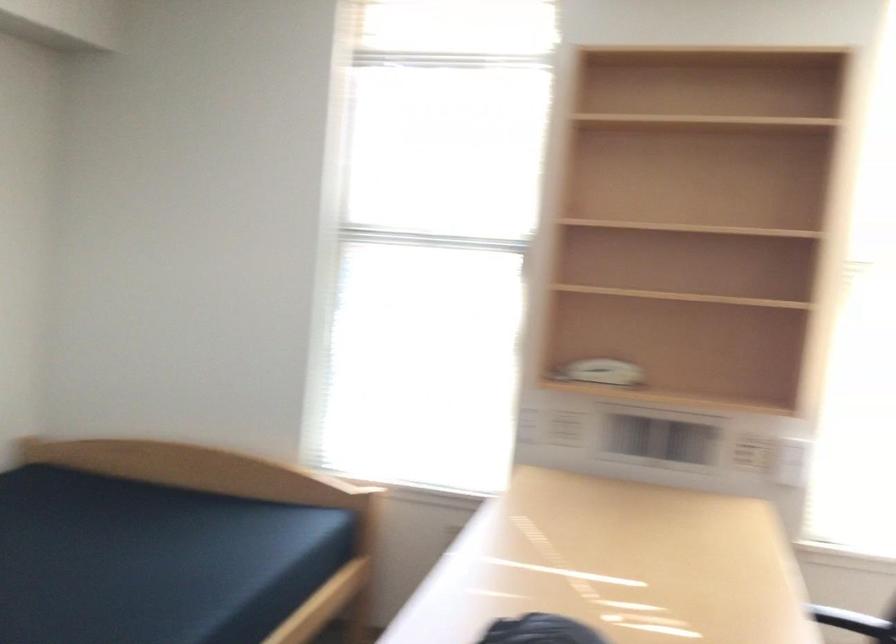
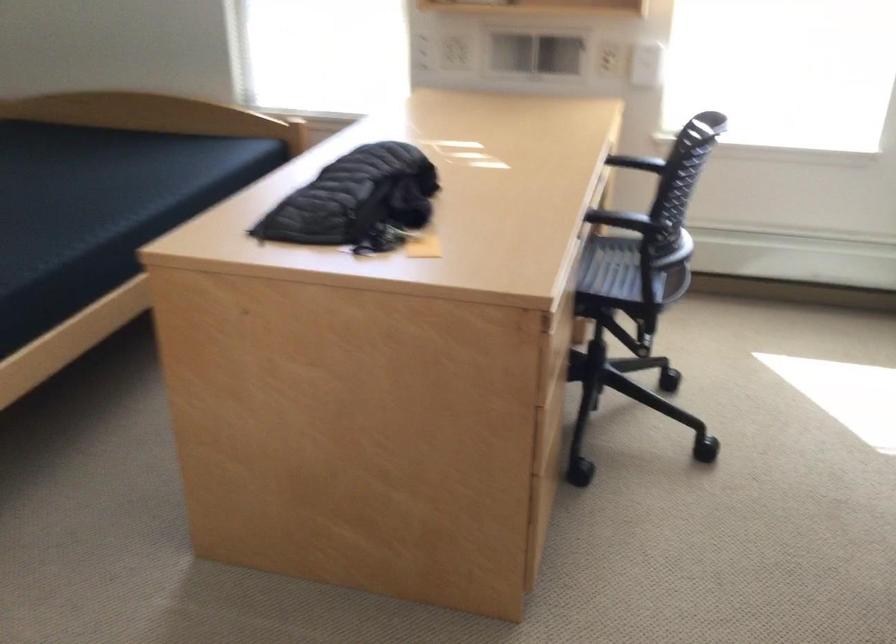
In the second image, find the point that corresponds to pixel 755 460 in the first image.

(616, 62)